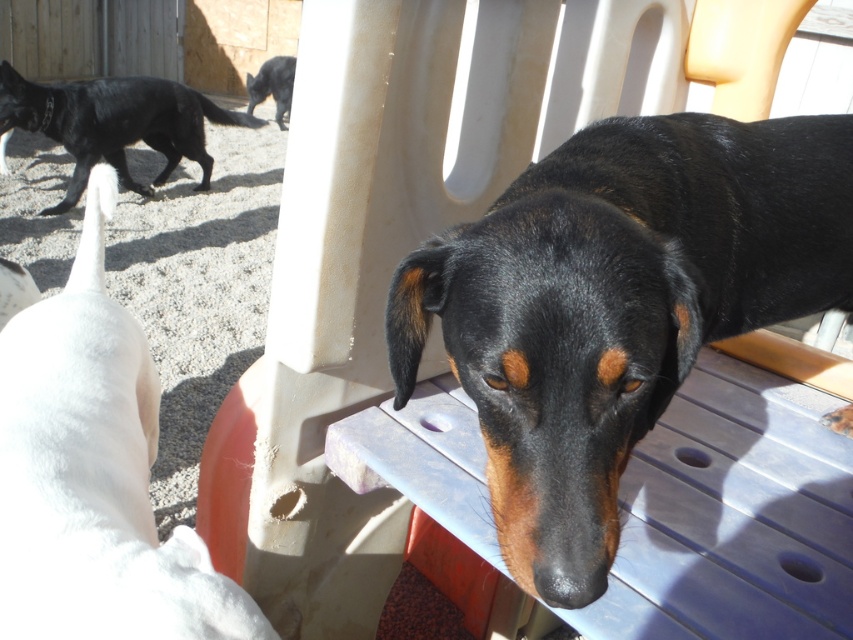
Question: Considering the real-world distances, which object is closest to the black shiny dog at center?

Choices:
 (A) black glossy dog at upper left
 (B) white fur dog at lower left

Answer: (B)

Question: From the image, what is the correct spatial relationship of black glossy dog at upper left in relation to shiny black cat at upper left?

Choices:
 (A) below
 (B) above

Answer: (A)

Question: Estimate the real-world distances between objects in this image. Which object is closer to the white fur dog at lower left?

Choices:
 (A) black shiny dog at center
 (B) black glossy dog at upper left
 (C) shiny black cat at upper left

Answer: (A)

Question: In this image, where is white fur dog at lower left located relative to shiny black cat at upper left?

Choices:
 (A) below
 (B) above

Answer: (A)

Question: Does black shiny dog at center appear on the right side of black glossy dog at upper left?

Choices:
 (A) yes
 (B) no

Answer: (A)

Question: Which of these objects is positioned closest to the black glossy dog at upper left?

Choices:
 (A) shiny black cat at upper left
 (B) white fur dog at lower left

Answer: (A)